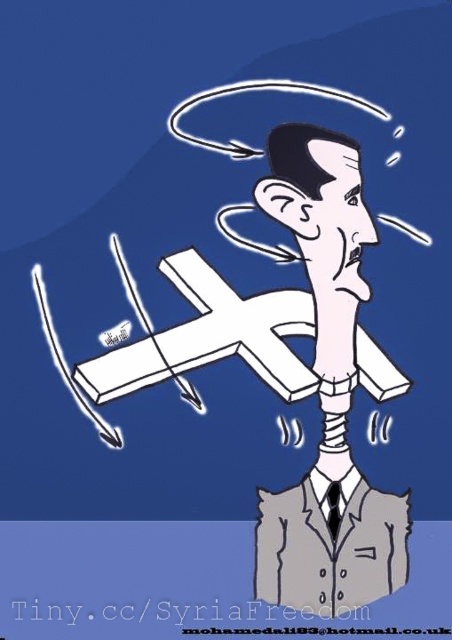
Image resolution: width=452 pixels, height=640 pixels. Describe the element at coordinates (252, 305) in the screenshot. I see `white matte cross at center` at that location.

Is point (282, 396) positioned behind point (343, 339)?

No, it is not.

You are a GUI agent. You are given a task and a screenshot of the screen. Output one action in this format:
    pyautogui.click(x=<x>, y=<y>)
    Task: Click on the white matte cross at center
    
    Given the screenshot: What is the action you would take?
    pyautogui.click(x=252, y=305)

In the scene shown: Between gray suit at center and gray fabric business suit at center, which one is positioned higher?

gray suit at center is higher up.

Can you confirm if gray suit at center is smaller than gray fabric business suit at center?

Actually, gray suit at center might be larger than gray fabric business suit at center.

This screenshot has height=640, width=452. I want to click on gray suit at center, so click(326, 394).

This screenshot has width=452, height=640. Find the location of `gray suit at center`. gray suit at center is located at coordinates (326, 394).

Can you confirm if white matte cross at center is bigger than gray fabric business suit at center?

Yes, white matte cross at center is bigger than gray fabric business suit at center.

Is white matte cross at center positioned in front of gray fabric business suit at center?

Yes, white matte cross at center is in front of gray fabric business suit at center.

The width and height of the screenshot is (452, 640). What do you see at coordinates (252, 305) in the screenshot? I see `white matte cross at center` at bounding box center [252, 305].

Locate an element on the screen. white matte cross at center is located at coordinates (252, 305).